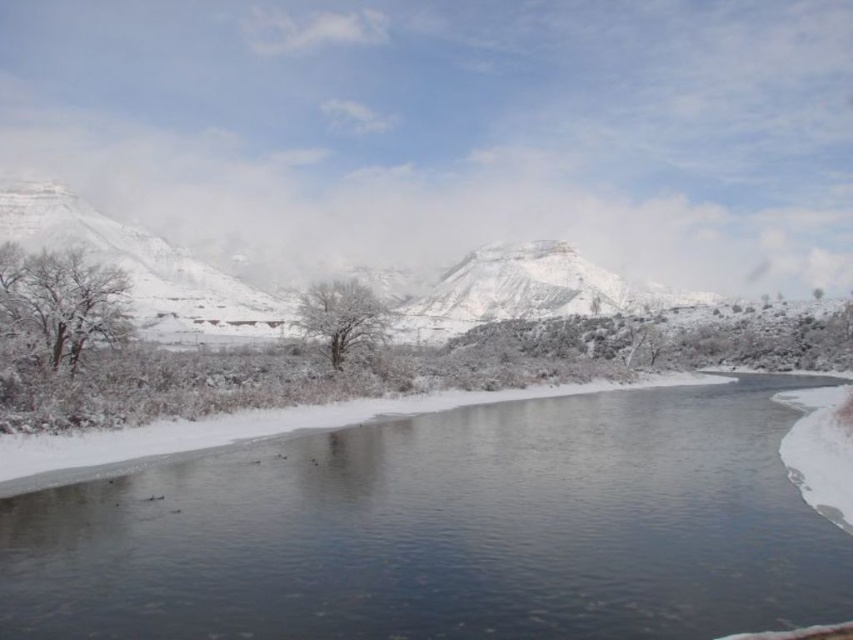
Looking at this image, you are standing at the edge of the snow covered river and see two points marked on the river surface. The first point is at coordinates point (416, 604) and the second point is at coordinates point (352, 339). Which point is closer to you?

Point (416, 604) is closer to the viewer than point (352, 339).